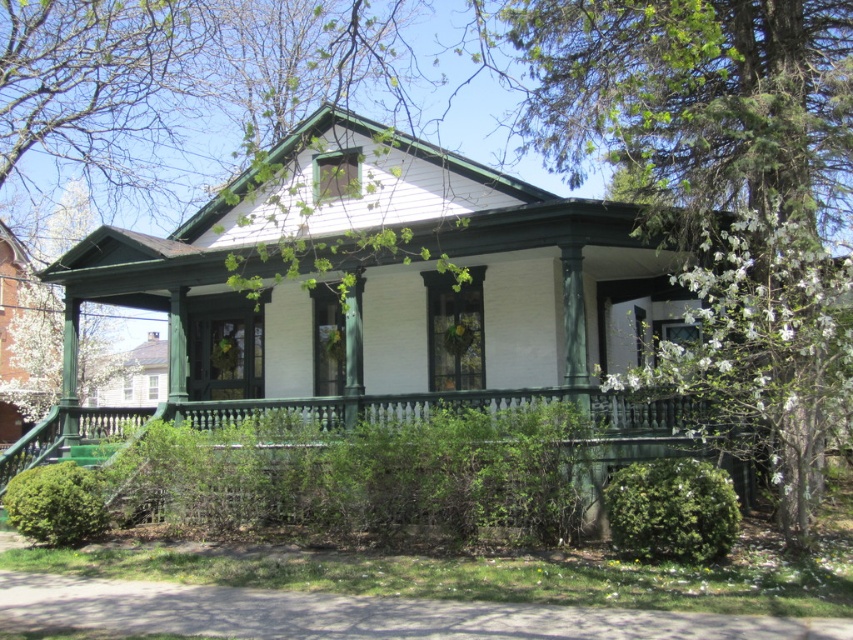
You are standing in front of the house and want to take a photo of the green painted wood porch at center. To avoid having the white blossoming tree at right in the background, where should you position yourself relative to the porch?

You should position yourself to the left side of the green painted wood porch at center so that the white blossoming tree at right is not in the background.

You are standing on the front lawn and looking at the house. Which object, the white blossoming tree at right or the green painted wood porch at center, is closer to you?

The white blossoming tree at right is closer to you because it is in front of the green painted wood porch at center.

You are a landscape architect designing a garden for this house. You have the white blossoming tree at right and the green painted wood porch at center. Which of these two features takes up more space in the front yard?

The green painted wood porch at center occupies more space than the white blossoming tree at right.